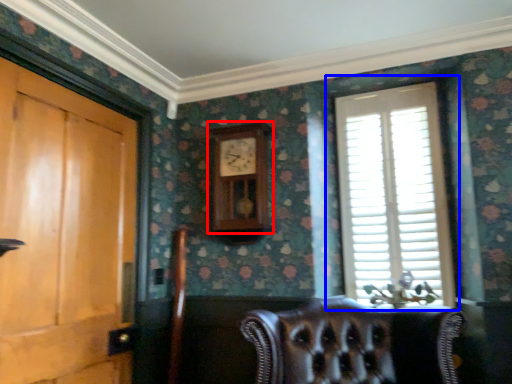
Question: Which object is closer to the camera taking this photo, clock (highlighted by a red box) or window (highlighted by a blue box)?

Choices:
 (A) clock
 (B) window

Answer: (B)